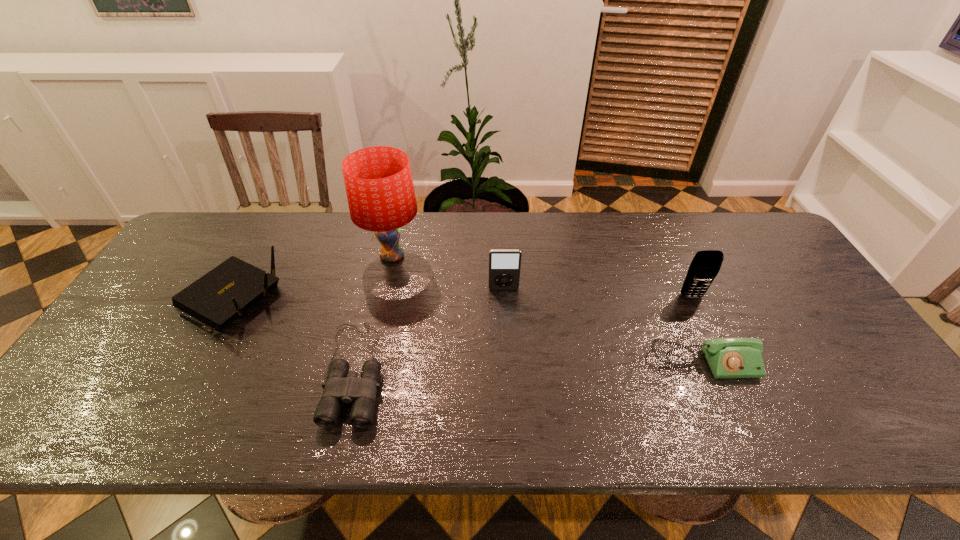
Locate an element on the screen. The height and width of the screenshot is (540, 960). lampshade is located at coordinates (380, 192).

Locate an element on the screen. The width and height of the screenshot is (960, 540). cellular telephone is located at coordinates (706, 264).

This screenshot has height=540, width=960. In order to click on iPod in this screenshot , I will do `click(504, 264)`.

What are the coordinates of `the fourth tallest object` in the screenshot? It's located at (219, 297).

The image size is (960, 540). I want to click on the leftmost object, so click(219, 297).

The image size is (960, 540). What are the coordinates of `telephone` in the screenshot? It's located at (727, 357).

I want to click on binoculars, so click(342, 386).

The height and width of the screenshot is (540, 960). What are the coordinates of `free space located 0.260m on the front-facing side of the tallest object` in the screenshot? It's located at (507, 256).

You are a GUI agent. You are given a task and a screenshot of the screen. Output one action in this format:
    pyautogui.click(x=<x>, y=<y>)
    Task: Click on the free space located on the screen of the cellular telephone
    
    Given the screenshot: What is the action you would take?
    pyautogui.click(x=755, y=429)

The width and height of the screenshot is (960, 540). Identify the location of vacant area situated on the front-facing side of the third object from right to left. (505, 314).